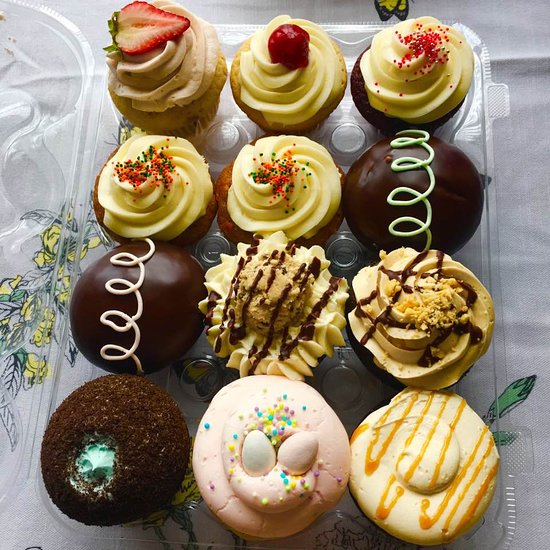
The width and height of the screenshot is (550, 550). Find the location of `white floral table cloth`. white floral table cloth is located at coordinates (36, 529).